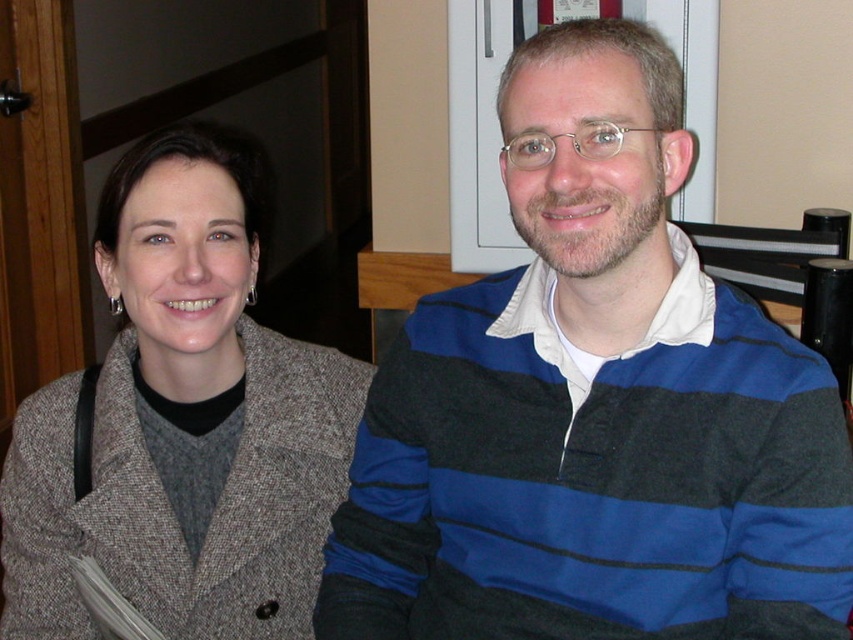
You are a photographer setting up for a portrait. You need to ensure that both the blue striped sweater at center and the matte gray coat at center are clearly visible in the photo. Based on their positions, which one might naturally be more in focus if you focus on the subject in front?

The blue striped sweater at center is in front of the matte gray coat at center, so focusing on the subject in front would naturally put the blue striped sweater at center in focus while the matte gray coat at center may appear slightly blurred.

You are a tailor who needs to determine which garment is shorter between the blue striped sweater at center and the matte gray coat at center. Based on the scene, which one should you choose?

The blue striped sweater at center is shorter than the matte gray coat at center, so you should choose the blue striped sweater at center.